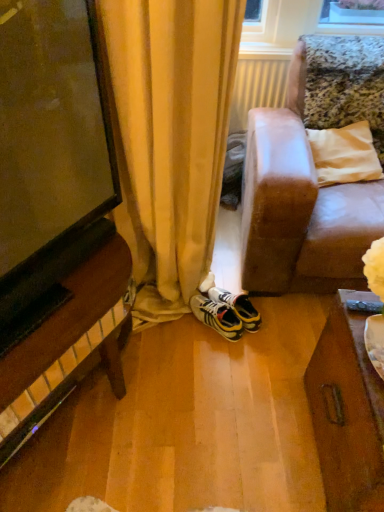
Question: From a real-world perspective, relative to white plastic radiator at center, is yellow and black sneakers at center vertically above or below?

Choices:
 (A) below
 (B) above

Answer: (A)

Question: Is yellow and black sneakers at center spatially inside white plastic radiator at center, or outside of it?

Choices:
 (A) outside
 (B) inside

Answer: (A)

Question: In the image, is yellow and black sneakers at center positioned in front of or behind white plastic radiator at center?

Choices:
 (A) front
 (B) behind

Answer: (A)

Question: Is white plastic radiator at center in front of or behind yellow and black sneakers at center in the image?

Choices:
 (A) front
 (B) behind

Answer: (B)

Question: In terms of width, does white plastic radiator at center look wider or thinner when compared to yellow and black sneakers at center?

Choices:
 (A) wide
 (B) thin

Answer: (B)

Question: Based on their sizes in the image, would you say white plastic radiator at center is bigger or smaller than yellow and black sneakers at center?

Choices:
 (A) small
 (B) big

Answer: (B)

Question: Would you say white plastic radiator at center is to the left or to the right of yellow and black sneakers at center in the picture?

Choices:
 (A) left
 (B) right

Answer: (B)